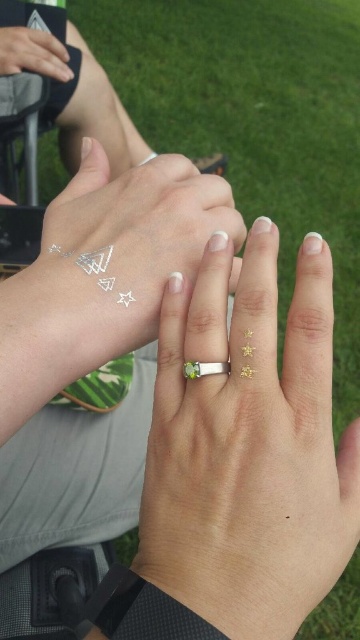
Question: In this image, where is silver/gold ring at center located relative to green gemstone ring at center?

Choices:
 (A) left
 (B) right

Answer: (B)

Question: Which object is positioned closest to the silver/gold ring at center?

Choices:
 (A) green gemstone ring at center
 (B) silver metallic temporary tattoo at upper left

Answer: (A)

Question: Does silver/gold ring at center have a smaller size compared to green gemstone ring at center?

Choices:
 (A) no
 (B) yes

Answer: (A)

Question: Which of the following is the closest to the observer?

Choices:
 (A) silver/gold ring at center
 (B) green gemstone ring at center
 (C) silver metallic temporary tattoo at upper left

Answer: (A)

Question: Among these objects, which one is nearest to the camera?

Choices:
 (A) silver/gold ring at center
 (B) silver metallic temporary tattoo at upper left

Answer: (A)

Question: Does silver/gold ring at center have a larger size compared to green gemstone ring at center?

Choices:
 (A) no
 (B) yes

Answer: (B)